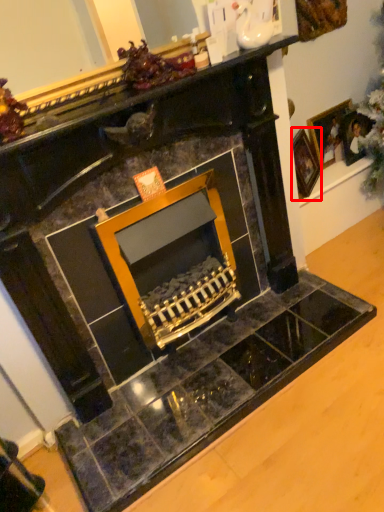
Question: Observing the image, what is the correct spatial positioning of picture frame (annotated by the red box) in reference to picture frame?

Choices:
 (A) right
 (B) left

Answer: (B)